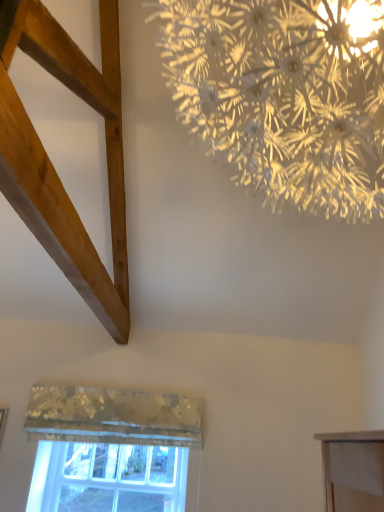
Question: Are natural wood plank at upper left and metallic textured curtain at lower center far apart?

Choices:
 (A) yes
 (B) no

Answer: (B)

Question: From a real-world perspective, is natural wood plank at upper left positioned over metallic textured curtain at lower center based on gravity?

Choices:
 (A) yes
 (B) no

Answer: (A)

Question: Does natural wood plank at upper left appear on the right side of metallic textured curtain at lower center?

Choices:
 (A) no
 (B) yes

Answer: (B)

Question: Is natural wood plank at upper left wider than metallic textured curtain at lower center?

Choices:
 (A) no
 (B) yes

Answer: (B)

Question: Is natural wood plank at upper left closer to camera compared to metallic textured curtain at lower center?

Choices:
 (A) no
 (B) yes

Answer: (B)

Question: Is metallic textured curtain at lower center in front of or behind clear glass window at lower left in the image?

Choices:
 (A) behind
 (B) front

Answer: (B)

Question: Is metallic textured curtain at lower center to the left or to the right of clear glass window at lower left in the image?

Choices:
 (A) right
 (B) left

Answer: (A)

Question: Do you think metallic textured curtain at lower center is within clear glass window at lower left, or outside of it?

Choices:
 (A) outside
 (B) inside

Answer: (A)

Question: Is metallic textured curtain at lower center wider or thinner than clear glass window at lower left?

Choices:
 (A) thin
 (B) wide

Answer: (B)

Question: Is metallic textured curtain at lower center wider or thinner than iridescent metallic chandelier at upper center?

Choices:
 (A) thin
 (B) wide

Answer: (A)

Question: Is metallic textured curtain at lower center taller or shorter than iridescent metallic chandelier at upper center?

Choices:
 (A) tall
 (B) short

Answer: (B)

Question: In the image, is metallic textured curtain at lower center on the left side or the right side of iridescent metallic chandelier at upper center?

Choices:
 (A) right
 (B) left

Answer: (B)

Question: From the image's perspective, is metallic textured curtain at lower center above or below iridescent metallic chandelier at upper center?

Choices:
 (A) above
 (B) below

Answer: (B)

Question: Considering the positions of clear glass window at lower left and natural wood plank at upper left in the image, is clear glass window at lower left bigger or smaller than natural wood plank at upper left?

Choices:
 (A) big
 (B) small

Answer: (B)

Question: In the image, is clear glass window at lower left on the left side or the right side of natural wood plank at upper left?

Choices:
 (A) right
 (B) left

Answer: (B)